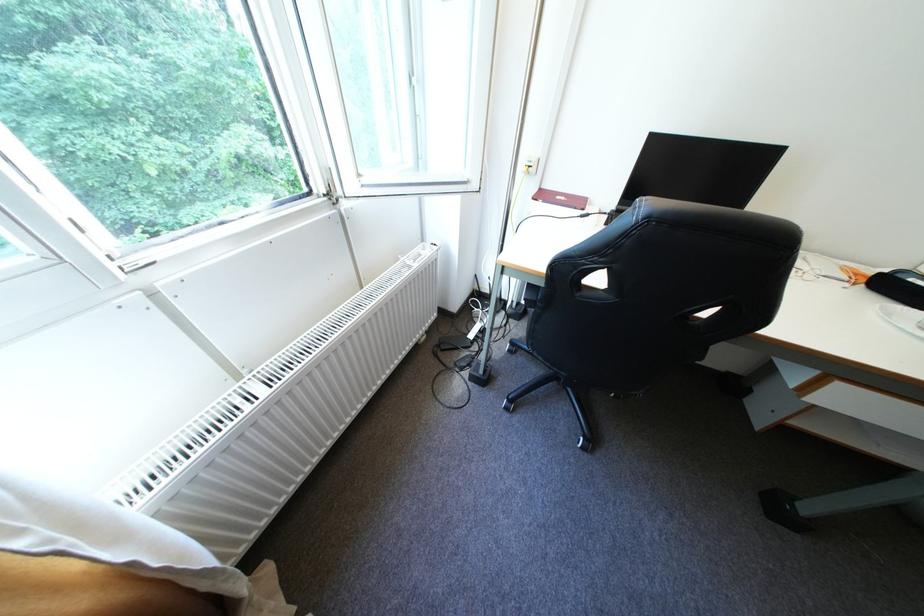
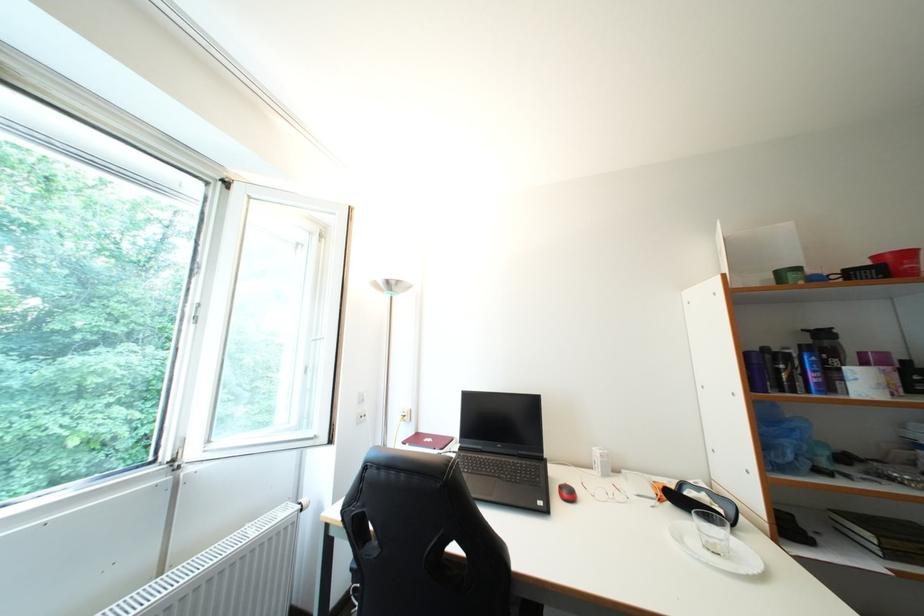
Question: The first image is from the beginning of the video and the second image is from the end. How did the camera likely rotate when shooting the video?

Choices:
 (A) Left
 (B) Right
 (C) Up
 (D) Down

Answer: (C)